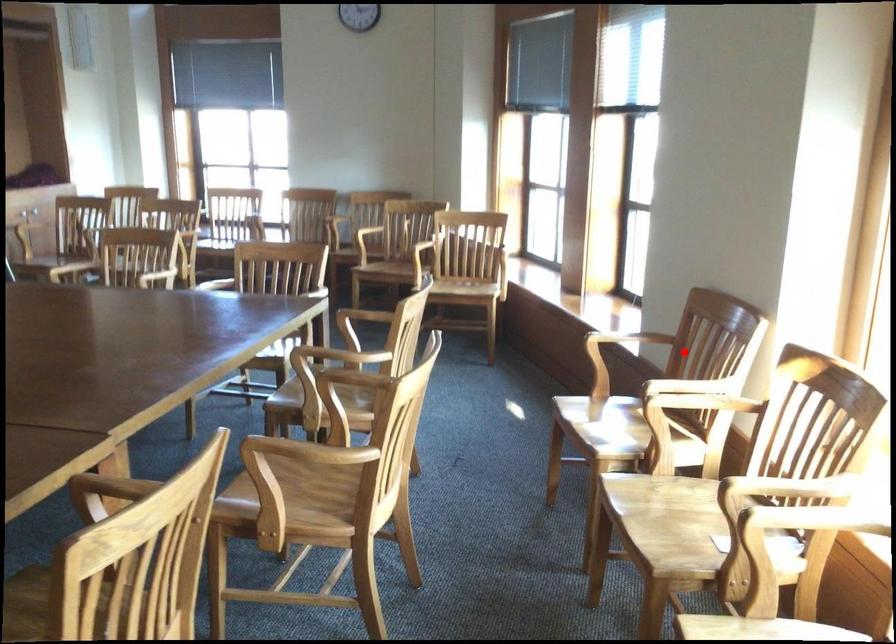
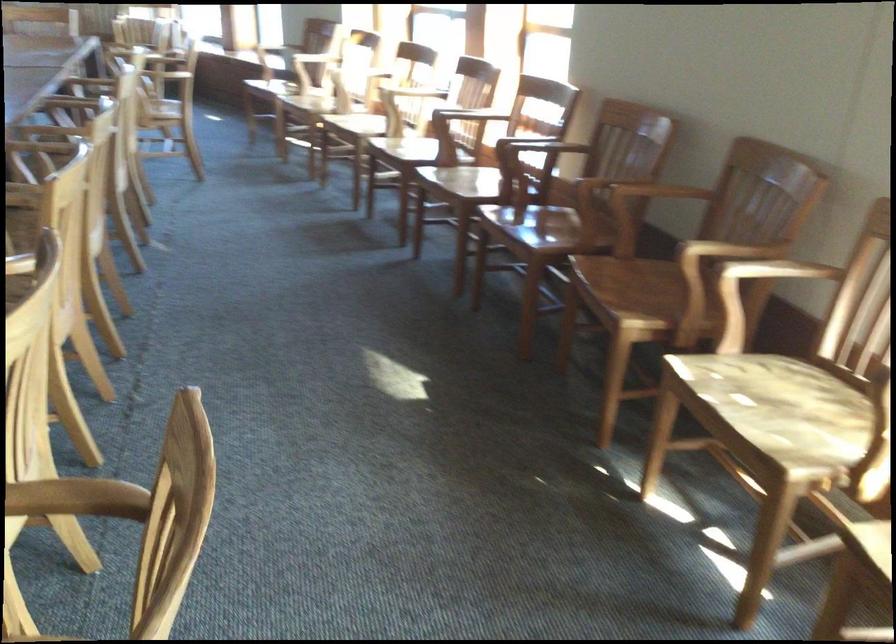
Question: I am providing you with two images of the same scene from different viewpoints. Image1 has a red point marked. In image2, the corresponding 3D location appears at what relative position? Reply with the corresponding letter.

Choices:
 (A) Closer
 (B) Farther

Answer: (B)